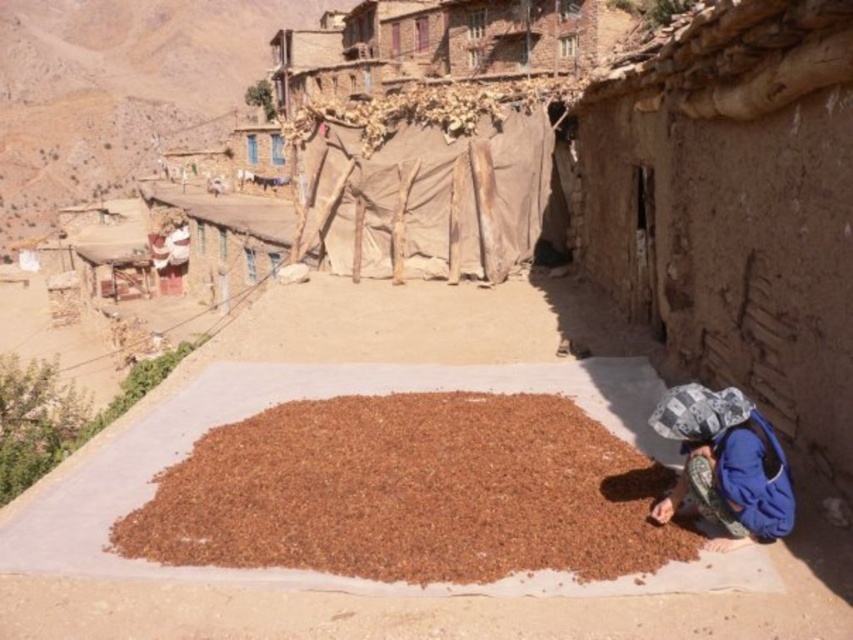
You are standing on the rooftop and notice two items below you. There is brown gravel at center and blue fabric at lower right. Which item is positioned to the left of the other?

The brown gravel at center is to the left of blue fabric at lower right.

You are standing at the viewpoint of the image and see two points labeled as point (550, 412) and point (728, 468). Which point is closer to you?

Point (728, 468) is closer to you because it is in front of point (550, 412).